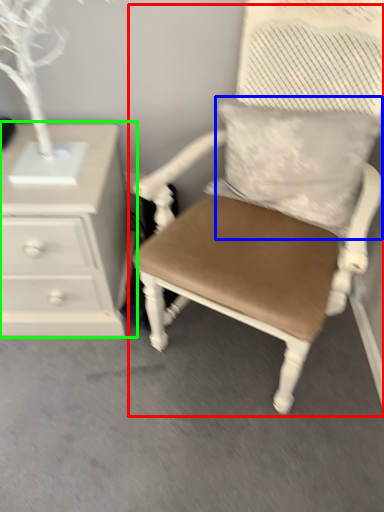
Question: Which object is positioned closest to chair (highlighted by a red box)? Select from pillow (highlighted by a blue box) and chest of drawers (highlighted by a green box).

Choices:
 (A) pillow
 (B) chest of drawers

Answer: (A)